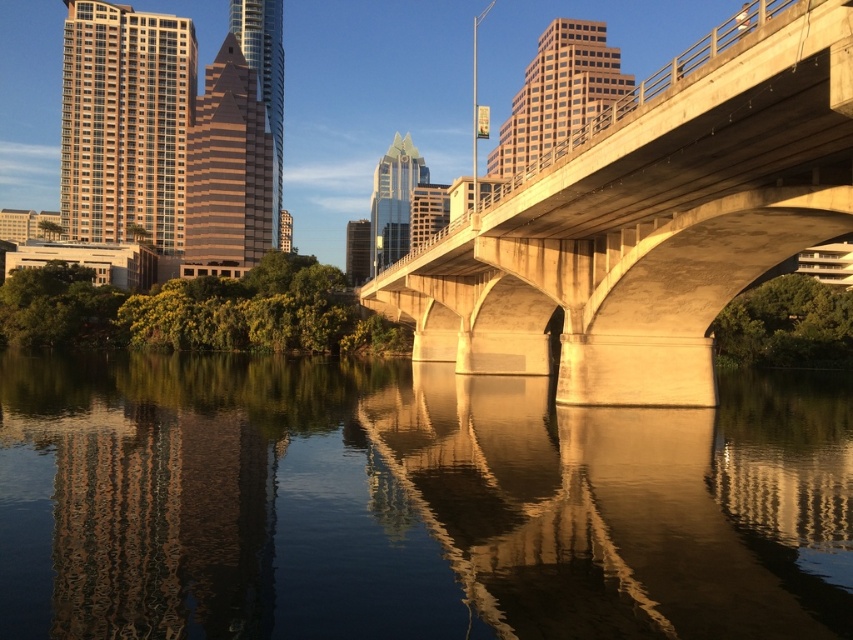
Question: Which point is farther to the camera?

Choices:
 (A) smooth water at center
 (B) concrete bridge at center

Answer: (B)

Question: Where is smooth water at center located in relation to concrete bridge at center in the image?

Choices:
 (A) right
 (B) left

Answer: (B)

Question: From the image, what is the correct spatial relationship of smooth water at center in relation to concrete bridge at center?

Choices:
 (A) right
 (B) left

Answer: (B)

Question: Can you confirm if smooth water at center is positioned to the right of concrete bridge at center?

Choices:
 (A) yes
 (B) no

Answer: (B)

Question: Which of the following is the closest to the observer?

Choices:
 (A) smooth water at center
 (B) concrete bridge at center

Answer: (A)